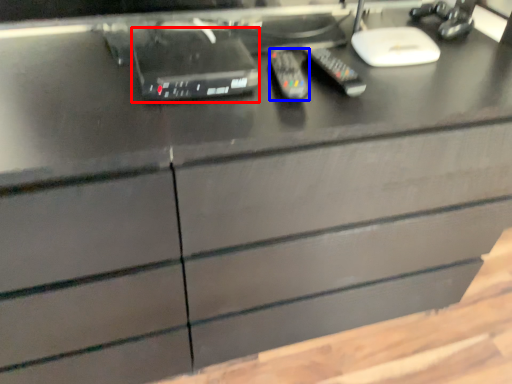
Question: Which object appears farthest to the camera in this image, equipment (highlighted by a red box) or control (highlighted by a blue box)?

Choices:
 (A) equipment
 (B) control

Answer: (B)